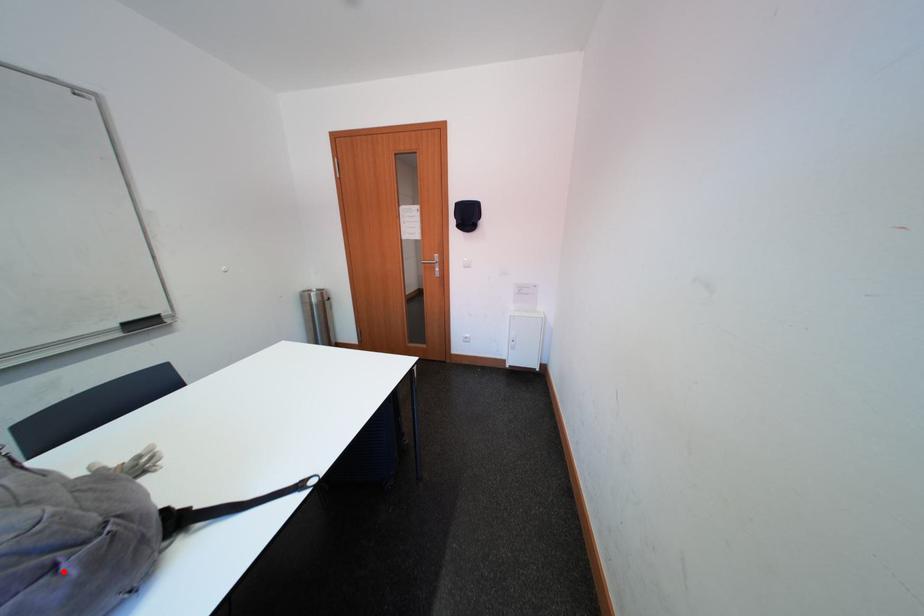
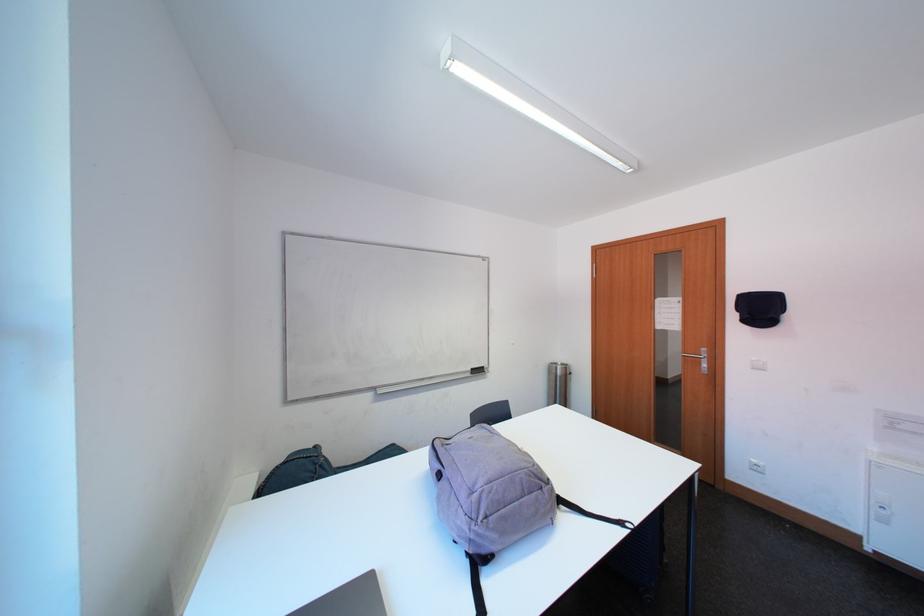
In the second image, find the point that corresponds to the highlighted location in the first image.

(551, 492)